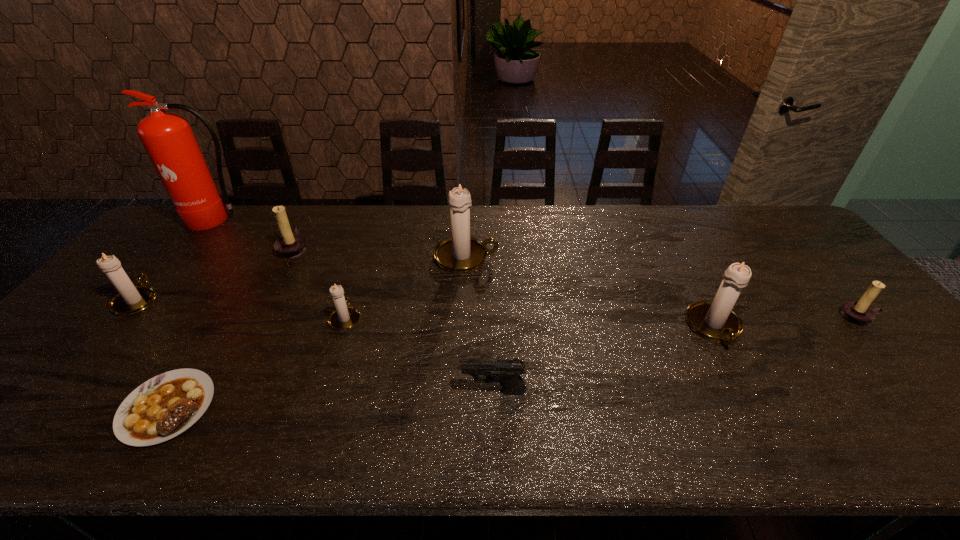
Where is `vacant point located between the left brown candle holder and the steak`? vacant point located between the left brown candle holder and the steak is located at coordinates (230, 328).

Locate an element on the screen. vacant area between the leftmost white candle holder and the bigger brown candle holder is located at coordinates (216, 274).

Point out which object is positioned as the sixth nearest to the right brown candle holder. Please provide its 2D coordinates. Your answer should be formatted as a tuple, i.e. [(x, y)], where the tuple contains the x and y coordinates of a point satisfying the conditions above.

[(166, 405)]

Identify the location of the second closest object to the steak. (344, 317).

Select which candle holder appears as the fourth closest to the shortest object. Please provide its 2D coordinates. Your answer should be formatted as a tuple, i.e. [(x, y)], where the tuple contains the x and y coordinates of a point satisfying the conditions above.

[(460, 253)]

This screenshot has height=540, width=960. In order to click on candle holder that is the third closest to the farthest white candle holder in this screenshot , I will do `click(715, 320)`.

Locate which white candle holder is the closest to the leftmost candle holder. Please provide its 2D coordinates. Your answer should be formatted as a tuple, i.e. [(x, y)], where the tuple contains the x and y coordinates of a point satisfying the conditions above.

[(344, 317)]

The height and width of the screenshot is (540, 960). I want to click on white candle holder that is the closest to the right brown candle holder, so click(x=715, y=320).